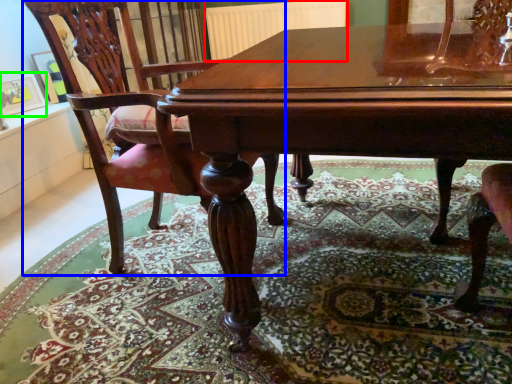
Question: Estimate the real-world distances between objects in this image. Which object is closer to radiator (highlighted by a red box), chair (highlighted by a blue box) or picture frame (highlighted by a green box)?

Choices:
 (A) chair
 (B) picture frame

Answer: (B)